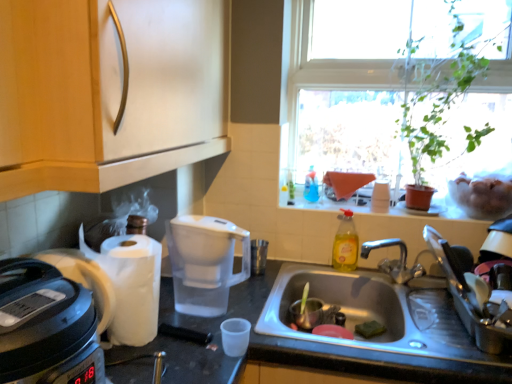
Question: From a real-world perspective, is translucent plastic bottle at upper right, positioned as the 1th bottle in top-to-bottom order, below wooden cabinet at upper left?

Choices:
 (A) no
 (B) yes

Answer: (B)

Question: Is translucent plastic bottle at upper right, positioned as the 1th bottle in top-to-bottom order, far from wooden cabinet at upper left?

Choices:
 (A) no
 (B) yes

Answer: (A)

Question: Is translucent plastic bottle at upper right, which is the 1th bottle in back-to-front order, in contact with wooden cabinet at upper left?

Choices:
 (A) yes
 (B) no

Answer: (B)

Question: From the image's perspective, does translucent plastic bottle at upper right, which is the 1th bottle in back-to-front order, appear higher than wooden cabinet at upper left?

Choices:
 (A) no
 (B) yes

Answer: (A)

Question: From the image's perspective, would you say translucent plastic bottle at upper right, positioned as the 1th bottle in top-to-bottom order, is shown under wooden cabinet at upper left?

Choices:
 (A) yes
 (B) no

Answer: (A)

Question: Is translucent plastic bottle at upper right, the 2th bottle in the front-to-back sequence, looking in the opposite direction of wooden cabinet at upper left?

Choices:
 (A) yes
 (B) no

Answer: (B)

Question: Is wooden cabinet at upper left wider than stainless steel sink at lower center?

Choices:
 (A) yes
 (B) no

Answer: (B)

Question: Can you confirm if wooden cabinet at upper left is thinner than stainless steel sink at lower center?

Choices:
 (A) yes
 (B) no

Answer: (A)

Question: Is wooden cabinet at upper left shorter than stainless steel sink at lower center?

Choices:
 (A) no
 (B) yes

Answer: (A)

Question: Is wooden cabinet at upper left oriented away from stainless steel sink at lower center?

Choices:
 (A) no
 (B) yes

Answer: (A)

Question: Considering the relative sizes of wooden cabinet at upper left and stainless steel sink at lower center in the image provided, is wooden cabinet at upper left taller than stainless steel sink at lower center?

Choices:
 (A) yes
 (B) no

Answer: (A)

Question: Can you confirm if wooden cabinet at upper left is bigger than stainless steel sink at lower center?

Choices:
 (A) no
 (B) yes

Answer: (B)

Question: Is there a large distance between metallic sink at lower center and transparent glass window at upper right?

Choices:
 (A) yes
 (B) no

Answer: (B)